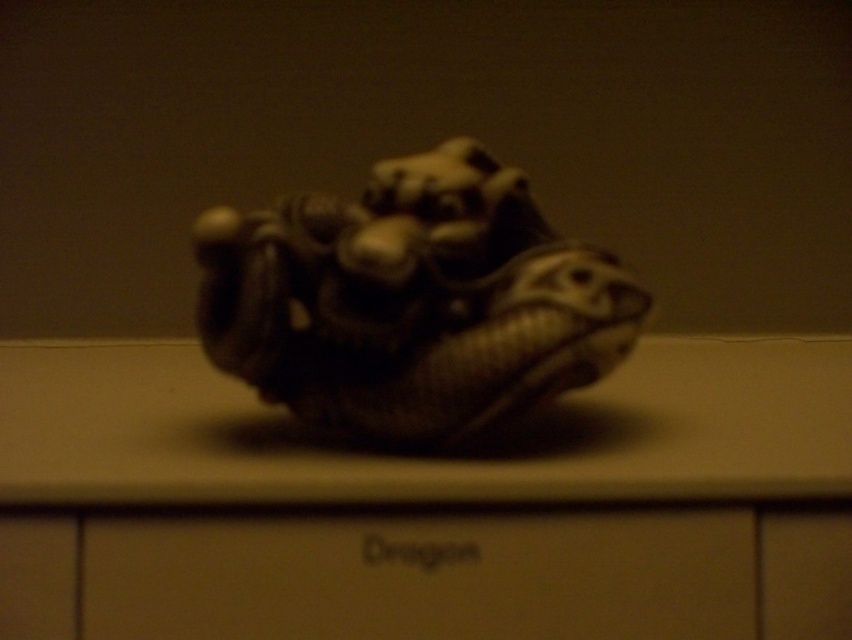
You are an archaeologist examining a mysterious artifact in a dark chamber. You notice two points on the surface of the artifact labeled as point (461, 196) and point (484, 525). Which point is closer to you as you stand in front of the artifact?

Point (461, 196) is closer to you because it is further to the viewer than point (484, 525).

You are organizing a museum exhibit and need to place the matte stone dragon at center and the matte brown drawer at center on a shelf. Given their sizes, which object should you place first to ensure they both fit on the shelf?

The matte stone dragon at center has a lesser width compared to the matte brown drawer at center, so you should place the matte brown drawer at center first to accommodate its larger size before placing the smaller dragon.

You are an art conservator standing 24 inches away from a display case containing the matte stone dragon at center. Can you safely approach closer to examine it without violating the 6 inches minimum safety distance rule?

The matte stone dragon at center is 23.79 inches away from the viewer. Since the minimum safety distance is 6 inches, you can approach closer as long as you stay at least 6 inches away. Subtracting the minimum distance from the current distance gives 23.79 minus 6 equals 17.79 inches. Therefore, you can move 17.79 inches closer to reach within 6 inches of the dragon.